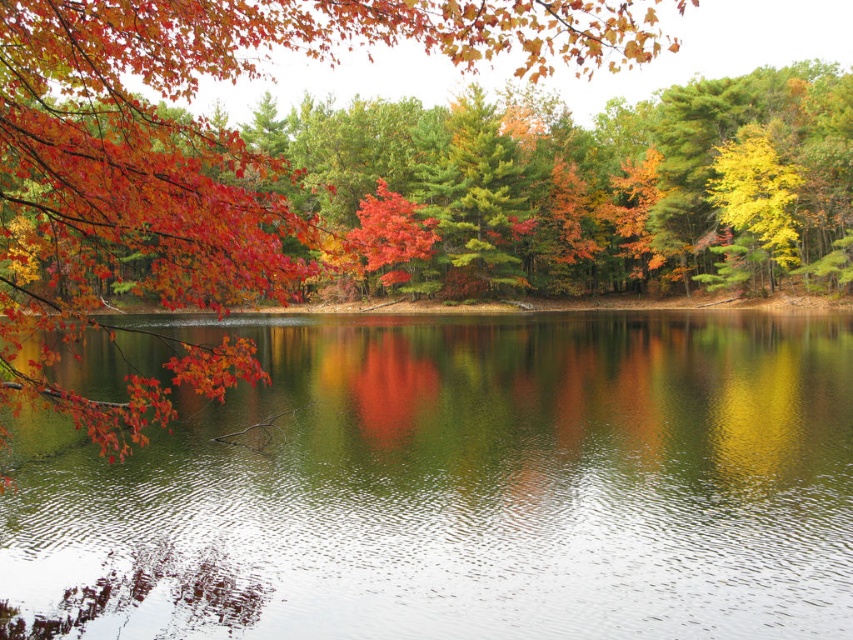
Measure the distance from green reflective water at center to shiny red leaves at upper left.

30.16 meters

Is green reflective water at center shorter than shiny red leaves at upper left?

Yes.

What do you see at coordinates (461, 484) in the screenshot?
I see `green reflective water at center` at bounding box center [461, 484].

The height and width of the screenshot is (640, 853). In order to click on green reflective water at center in this screenshot , I will do `click(461, 484)`.